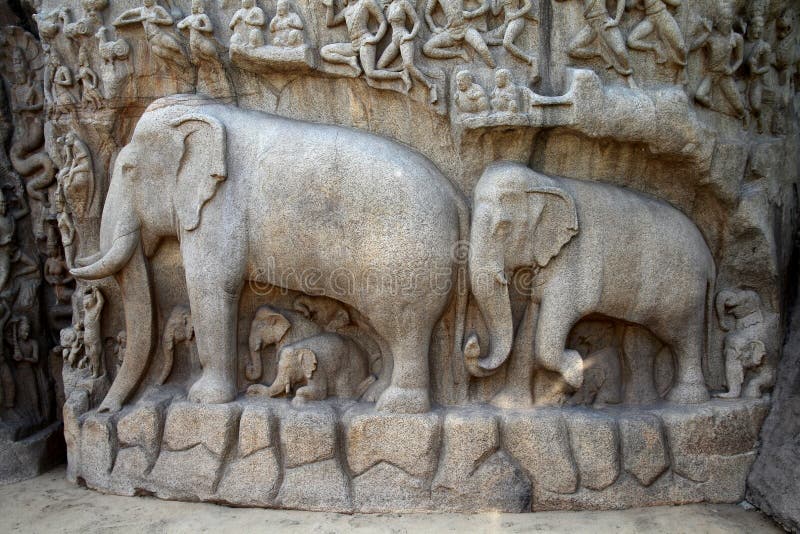
Locate an element on the screen. The width and height of the screenshot is (800, 534). stone floor is located at coordinates (106, 502).